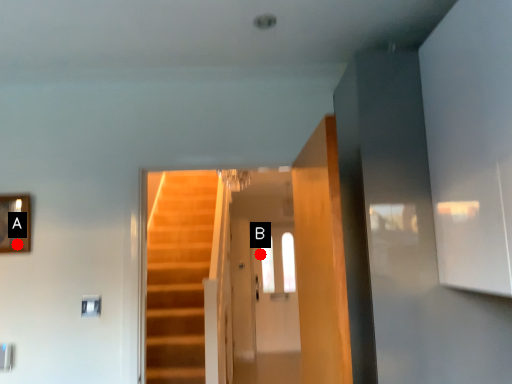
Question: Two points are circled on the image, labeled by A and B beside each circle. Which point is further to the camera?

Choices:
 (A) A is further
 (B) B is further

Answer: (B)